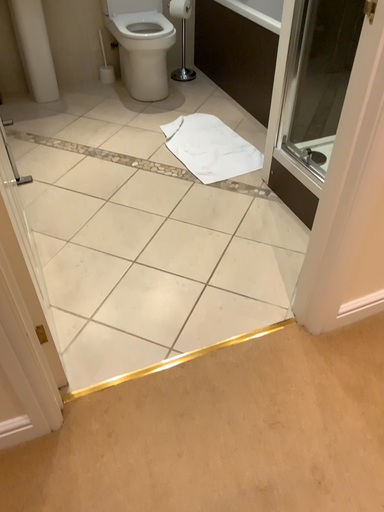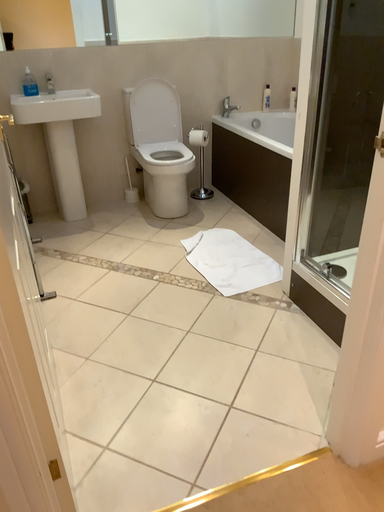
Question: How did the camera likely rotate when shooting the video?

Choices:
 (A) rotated upward
 (B) rotated downward

Answer: (A)